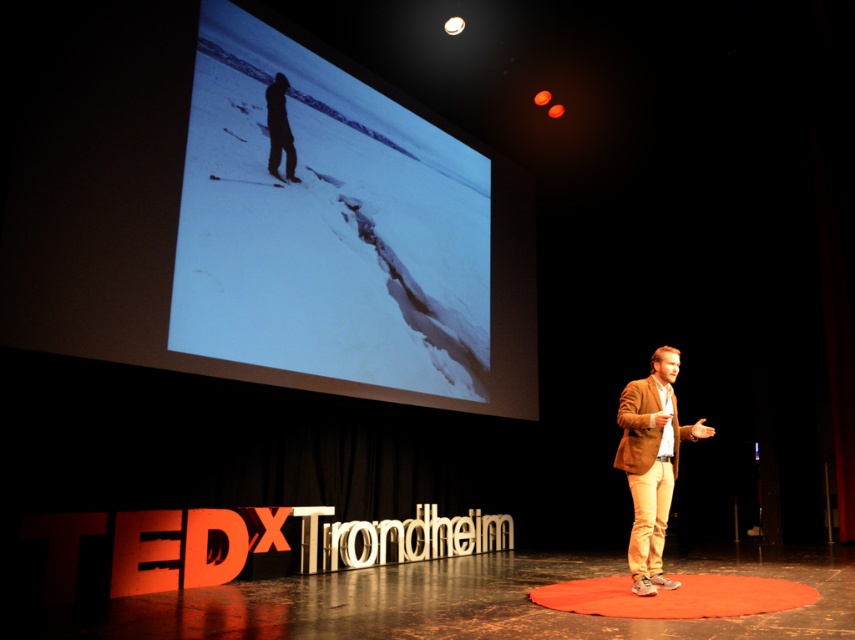
You are an event photographer at the TEDxTrondheim stage. You notice the silvery metallic screen at upper center and the dark silhouette figure at upper center. Which object is closer to the camera lens? Please explain your reasoning based on the scene description.

The silvery metallic screen at upper center is closer to the camera lens because it is positioned in front of the dark silhouette figure at upper center, as stated in the scene description.

You are standing on the stage at the TEDxTrondheim event. You need to place a small podium for a presenter. The podium must be positioned exactly where the silvery metallic screen at upper center is located. Is this possible? Please explain your reasoning based on the screen location.

The silvery metallic screen at upper center is located at coordinates (x=326, y=225). Since the screen is already occupying that position, placing a podium there would require removing the screen first.